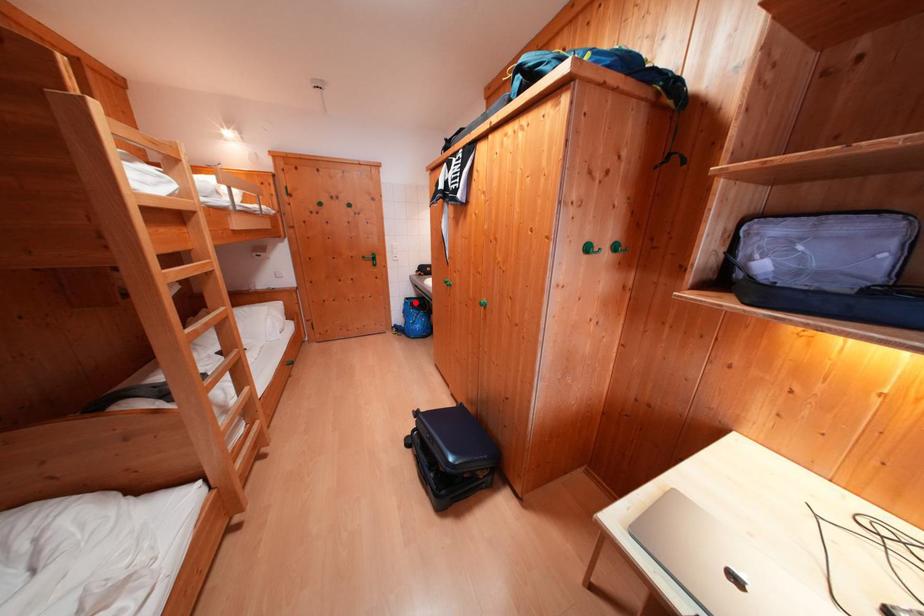
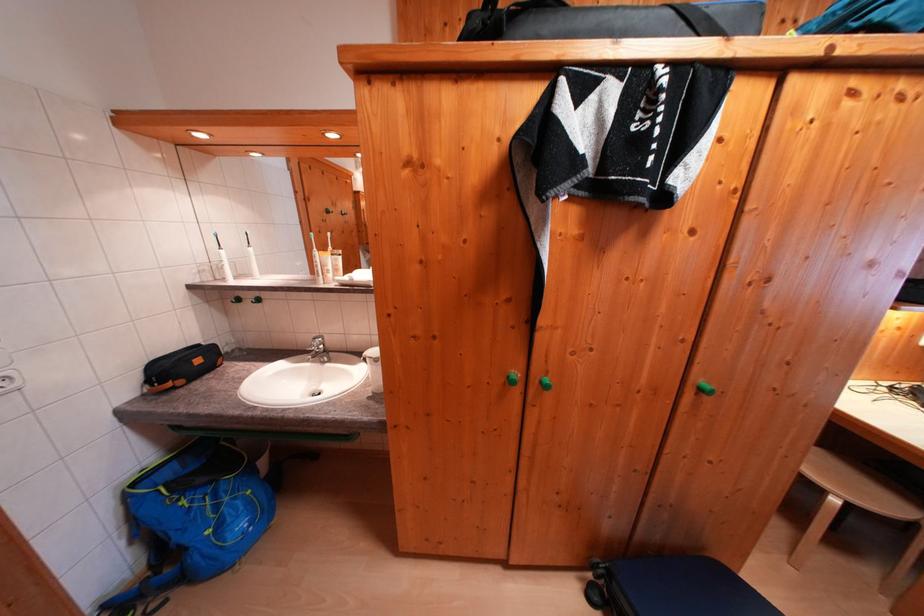
Where in the second image is the point corresponding to the highlighted location from the first image?

(142, 488)